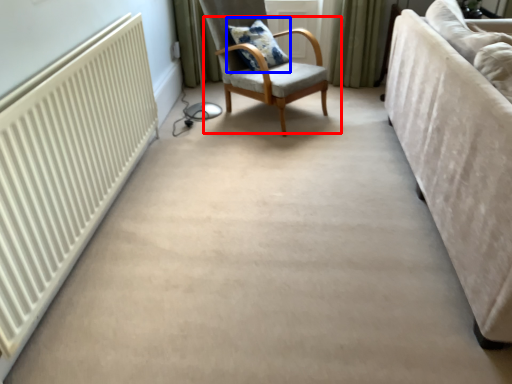
Question: Among these objects, which one is farthest to the camera, chair (highlighted by a red box) or pillow (highlighted by a blue box)?

Choices:
 (A) chair
 (B) pillow

Answer: (B)